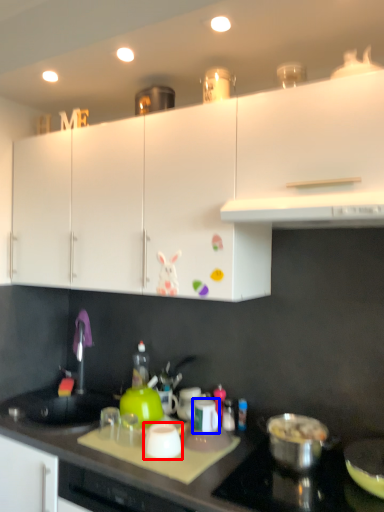
Question: Which object is further to the camera taking this photo, kitchen appliance (highlighted by a red box) or kitchen appliance (highlighted by a blue box)?

Choices:
 (A) kitchen appliance
 (B) kitchen appliance

Answer: (B)